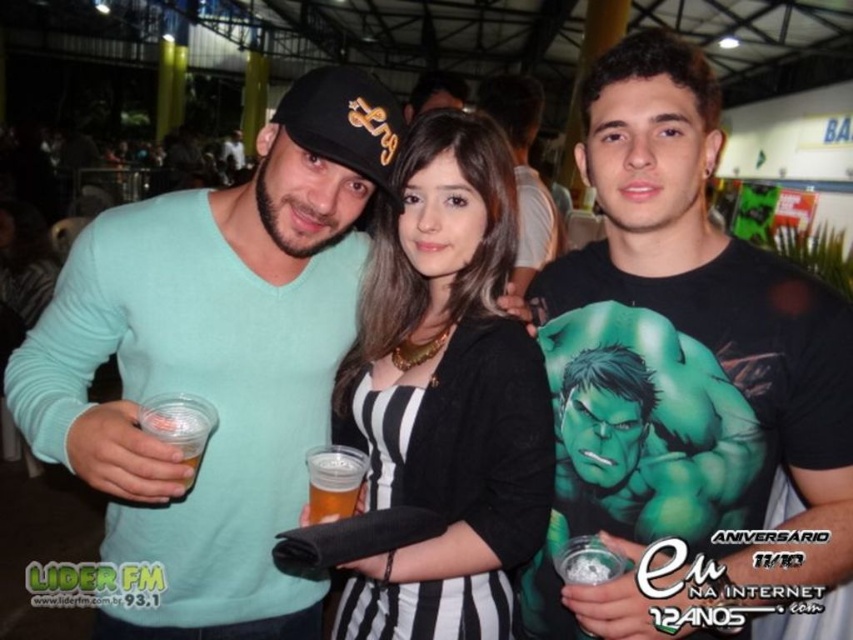
You are a photographer at the event and want to take a photo of both the black matte shirt at center and the green matte hulk shirt at center. However, you need to ensure that both are fully visible in the frame. Based on their positions, which shirt should you focus on first to ensure both are visible?

The black matte shirt at center is in front of the green matte hulk shirt at center, so you should focus on the black matte shirt at center first to ensure both are visible in the frame.

You are a photographer at the event and want to take a photo of both the black matte shirt at center and the green fabric hulk at center. Which one should you focus on first to ensure both are in focus?

You should focus on the black matte shirt at center first because it is closer to the viewer than the green fabric hulk at center, so adjusting focus from near to far will help ensure both are in focus.